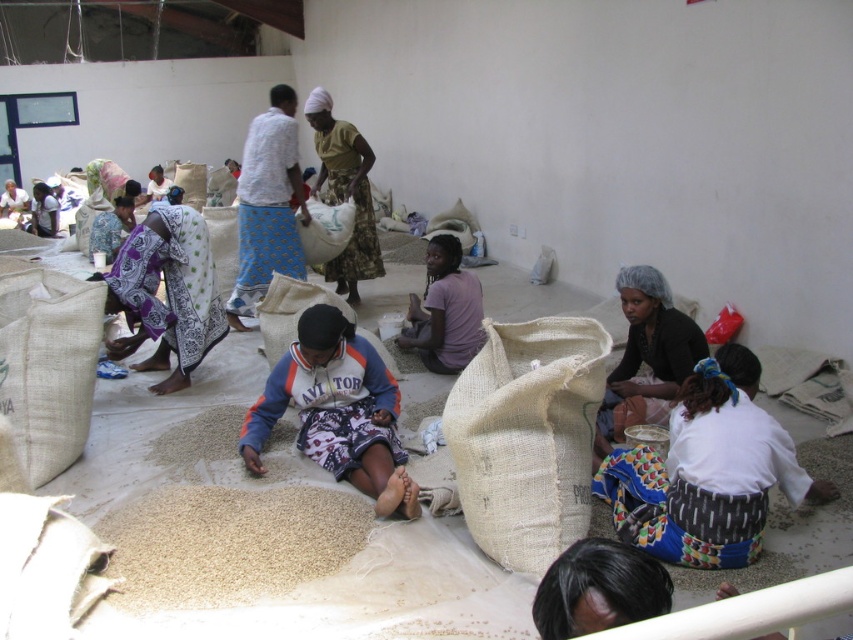
Question: Which of these objects is positioned closest to the purple matte shirt at center?

Choices:
 (A) yellow-green fabric bag at center
 (B) brown grain at center

Answer: (A)

Question: Does brown grain at center lie in front of black hair net at center?

Choices:
 (A) yes
 (B) no

Answer: (A)

Question: Which point is farther to the camera?

Choices:
 (A) (436, 362)
 (B) (729, 518)

Answer: (A)

Question: Which of the following is the farthest from the observer?

Choices:
 (A) brown grain at center
 (B) purple matte shirt at center
 (C) matte blue sweatshirt at center
 (D) black hair net at center

Answer: (B)

Question: Can you confirm if brown grain at center is positioned to the left of black hair net at center?

Choices:
 (A) no
 (B) yes

Answer: (B)

Question: Can you confirm if purple printed fabric at left is positioned to the left of purple matte shirt at center?

Choices:
 (A) yes
 (B) no

Answer: (A)